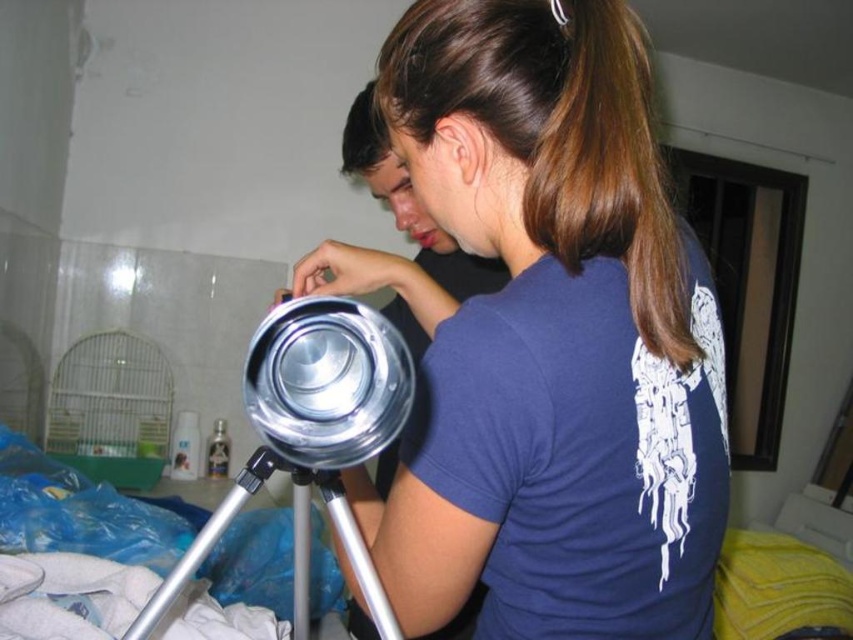
You are trying to determine the position of the shiny metallic tripod at center and the silver metallic tripod at center in the image. Which one is positioned higher?

The shiny metallic tripod at center is located above the silver metallic tripod at center, so it is positioned higher.

You are a photographer standing 24 inches away from a camera. You want to take a photo of the shiny metallic tripod at center. Is the tripod within your camera range?

The shiny metallic tripod at center is 21.95 inches away from the camera, which is within the 24 inches range. Therefore, the tripod is within the camera range.

You are standing in the room and want to move from the point at coordinates point (300, 262) to the point at coordinates point (241, 470). Which direction should you move in?

You should move backward because point (300, 262) is in front of point (241, 470).